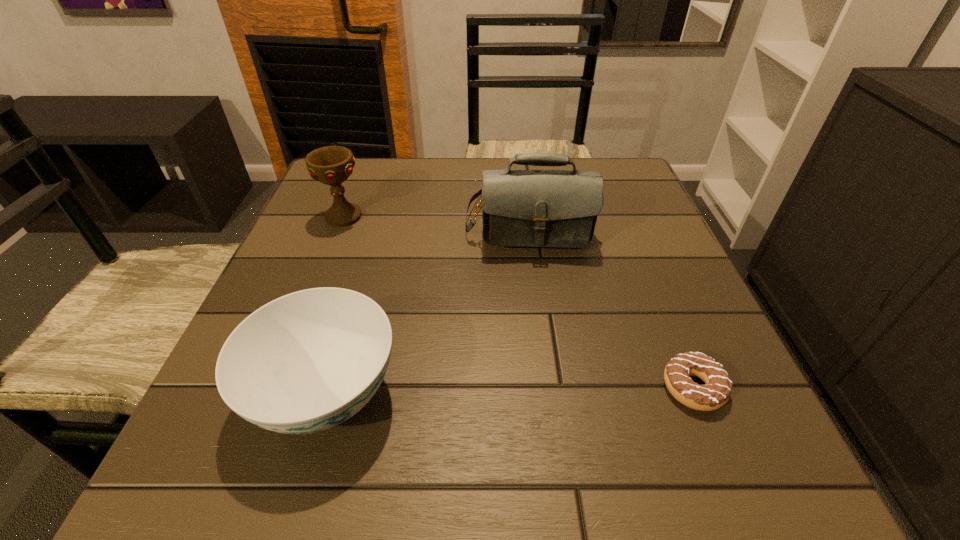
This screenshot has height=540, width=960. What are the coordinates of `vacant space that's between the tallest object and the chinaware` in the screenshot? It's located at (427, 304).

Image resolution: width=960 pixels, height=540 pixels. I want to click on free space between the shortest object and the chalice, so click(x=518, y=302).

The image size is (960, 540). In order to click on vacant space that's between the chalice and the rightmost object in this screenshot , I will do `click(518, 302)`.

Locate an element on the screen. This screenshot has height=540, width=960. blank region between the chalice and the third object from left to right is located at coordinates (435, 215).

Where is `free spot between the doughnut and the tallest object`? This screenshot has width=960, height=540. free spot between the doughnut and the tallest object is located at coordinates (611, 301).

You are a GUI agent. You are given a task and a screenshot of the screen. Output one action in this format:
    pyautogui.click(x=<x>, y=<y>)
    Task: Click on the object that is the third closest to the shortest object
    
    Given the screenshot: What is the action you would take?
    pyautogui.click(x=331, y=165)

This screenshot has width=960, height=540. What are the coordinates of `object that is the closest to the doughnut` in the screenshot? It's located at (520, 208).

Identify the location of vacant point that satisfies the following two spatial constraints: 1. on the back side of the second tallest object; 2. on the right side of the tallest object. (344, 214).